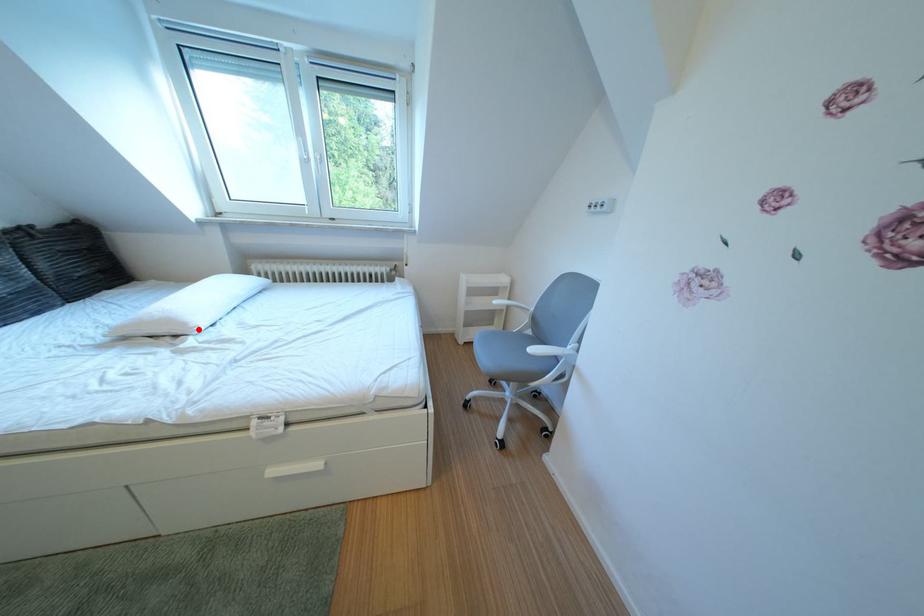
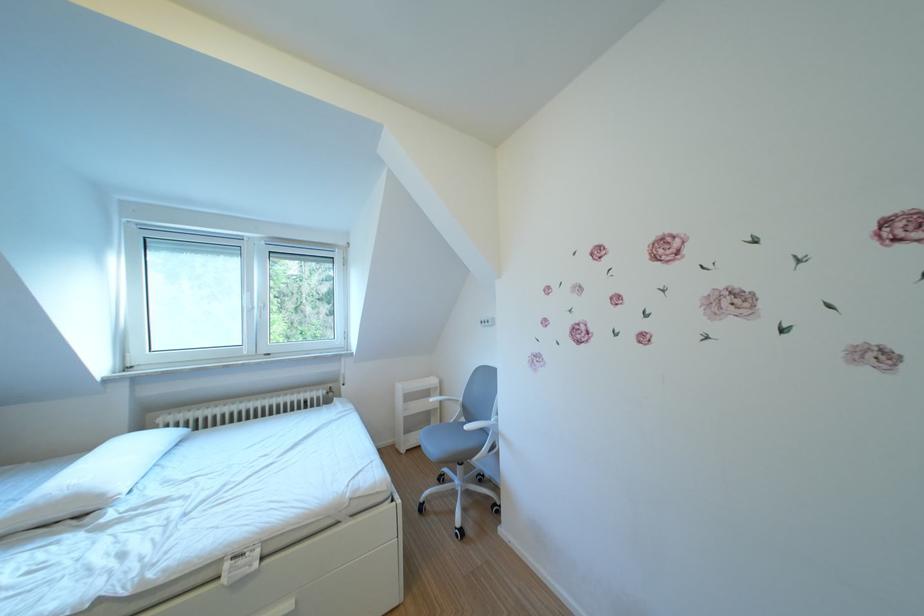
In the second image, find the point that corresponds to the highlighted location in the first image.

(115, 501)